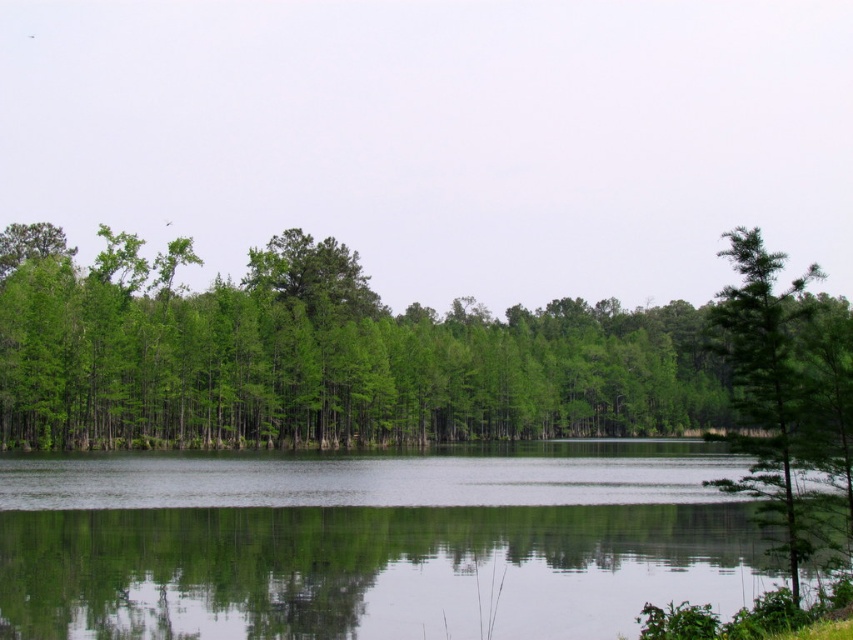
Question: Is transparent water at center behind green matte trees at center?

Choices:
 (A) no
 (B) yes

Answer: (A)

Question: Does green matte trees at center have a greater width compared to green leafy tree at right?

Choices:
 (A) no
 (B) yes

Answer: (B)

Question: Which point is closer to the camera?

Choices:
 (A) (645, 346)
 (B) (770, 291)

Answer: (B)

Question: Among these objects, which one is nearest to the camera?

Choices:
 (A) green matte trees at center
 (B) transparent water at center
 (C) green leafy tree at right

Answer: (B)

Question: Does green matte trees at center come behind green leafy tree at right?

Choices:
 (A) yes
 (B) no

Answer: (A)

Question: Estimate the real-world distances between objects in this image. Which object is farther from the green matte trees at center?

Choices:
 (A) green leafy tree at right
 (B) transparent water at center

Answer: (A)